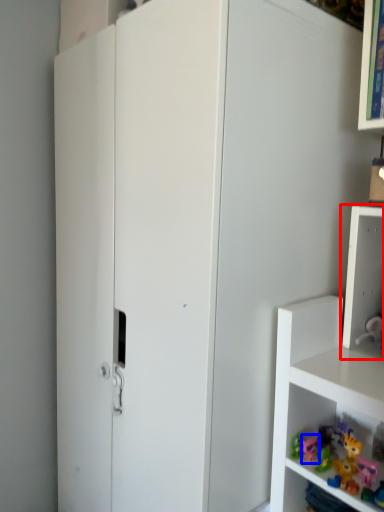
Question: Which point is further to the camera, shelf (highlighted by a red box) or toy (highlighted by a blue box)?

Choices:
 (A) shelf
 (B) toy

Answer: (B)